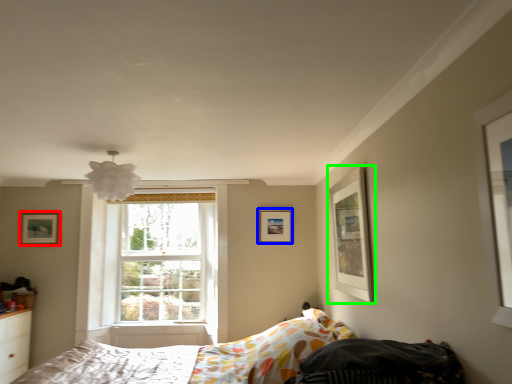
Question: Which object is the farthest from picture frame (highlighted by a red box)? Choose among these: picture frame (highlighted by a blue box) or picture frame (highlighted by a green box).

Choices:
 (A) picture frame
 (B) picture frame

Answer: (B)